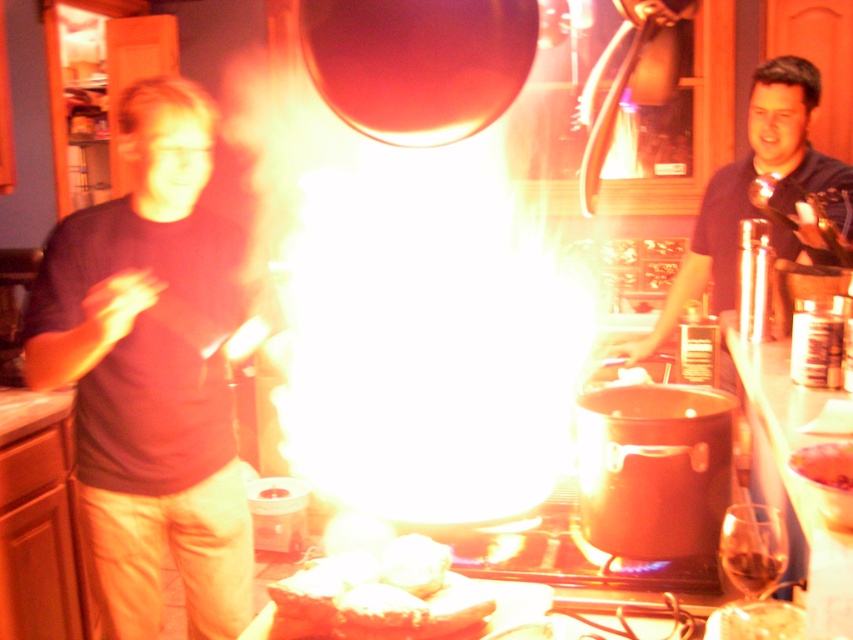
Does black matte shirt at right appear under smooth pinkish-red cake at center?

Incorrect, black matte shirt at right is not positioned below smooth pinkish-red cake at center.

Is black matte shirt at right positioned before smooth pinkish-red cake at center?

No.

What are the coordinates of `black matte shirt at right` in the screenshot? It's located at (746, 195).

Is point (315, 99) behind point (425, 566)?

Yes, point (315, 99) is behind point (425, 566).

From the picture: Who is more distant from viewer, (471, 486) or (399, 577)?

Point (471, 486)

The width and height of the screenshot is (853, 640). I want to click on white vapor at center, so click(x=405, y=314).

Who is lower down, white vapor at center or smooth pinkish-red cake at center?

smooth pinkish-red cake at center is below.

Is white vapor at center thinner than smooth pinkish-red cake at center?

No.

Locate an element on the screen. white vapor at center is located at coordinates (405, 314).